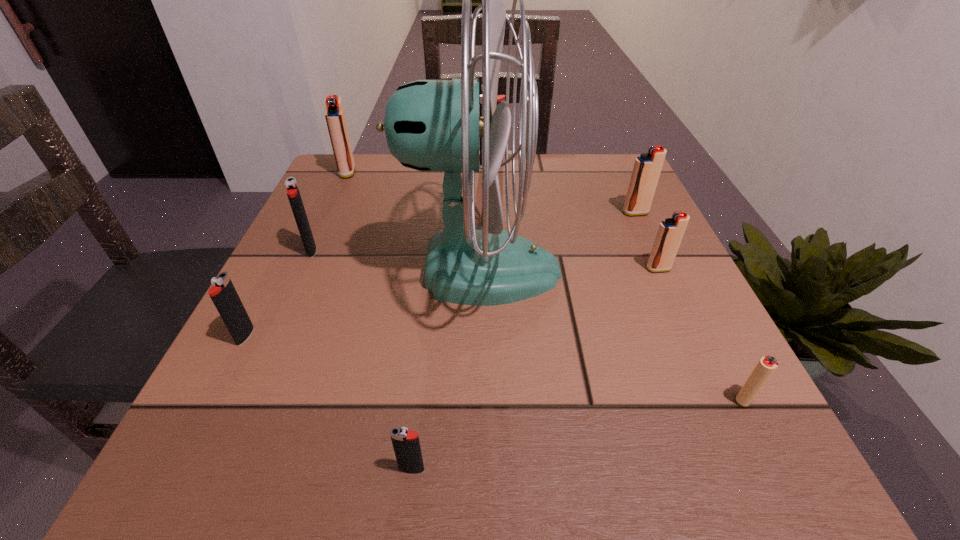
This screenshot has width=960, height=540. I want to click on the leftmost object, so [x=224, y=295].

Identify the location of the leftmost igniter. [x=224, y=295].

Identify the location of the fourth nearest igniter. This screenshot has height=540, width=960. (670, 233).

Where is `the third farthest red igniter`? the third farthest red igniter is located at coordinates (670, 233).

Image resolution: width=960 pixels, height=540 pixels. What are the coordinates of `the eighth farthest object` in the screenshot? It's located at (766, 366).

Find the location of a particular element. This screenshot has width=960, height=540. the smallest red igniter is located at coordinates (766, 366).

At what (x,y) coordinates should I click in order to perform the action: click on the nearest igniter. Please return your answer as a coordinate pair (x, y). The height and width of the screenshot is (540, 960). Looking at the image, I should click on (406, 444).

Find the location of `the smallest black igniter`. the smallest black igniter is located at coordinates (406, 444).

Find the location of a particular element. The height and width of the screenshot is (540, 960). free space located in front of the tallest object, directing airflow is located at coordinates (588, 271).

This screenshot has width=960, height=540. In order to click on vacant space located on the front of the biggest red igniter in this screenshot , I will do `click(317, 240)`.